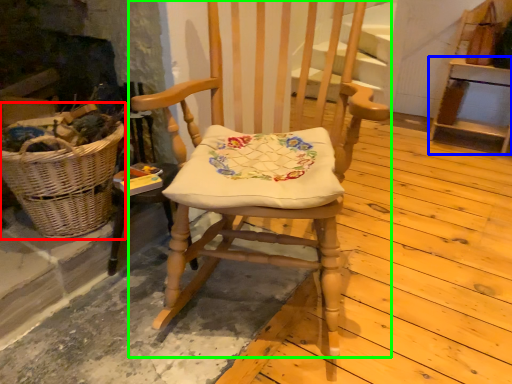
Question: Which is nearer to the picnic basket (highlighted by a red box)? furniture (highlighted by a blue box) or chair (highlighted by a green box).

Choices:
 (A) furniture
 (B) chair

Answer: (B)